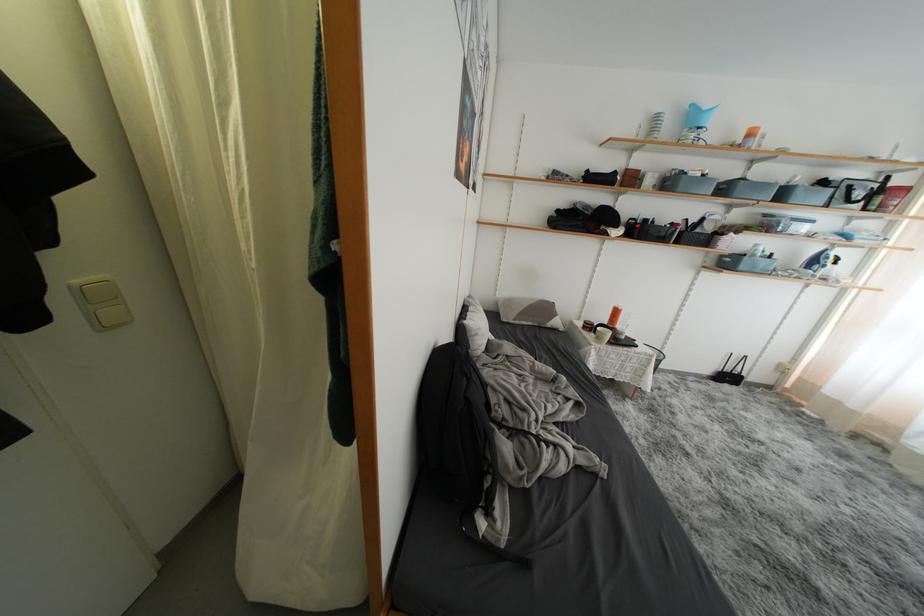
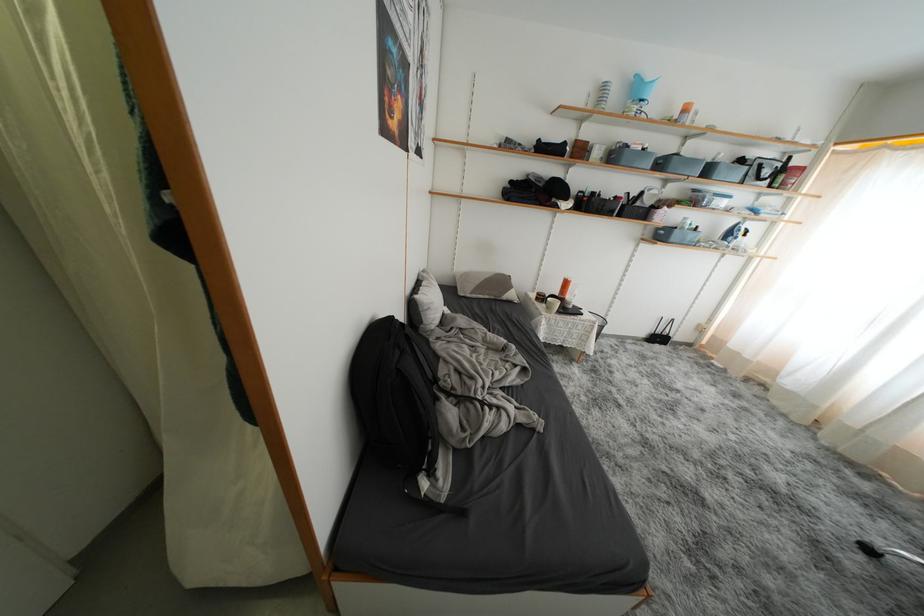
Locate, in the second image, the point that corresponds to [663,180] in the first image.

(610, 152)